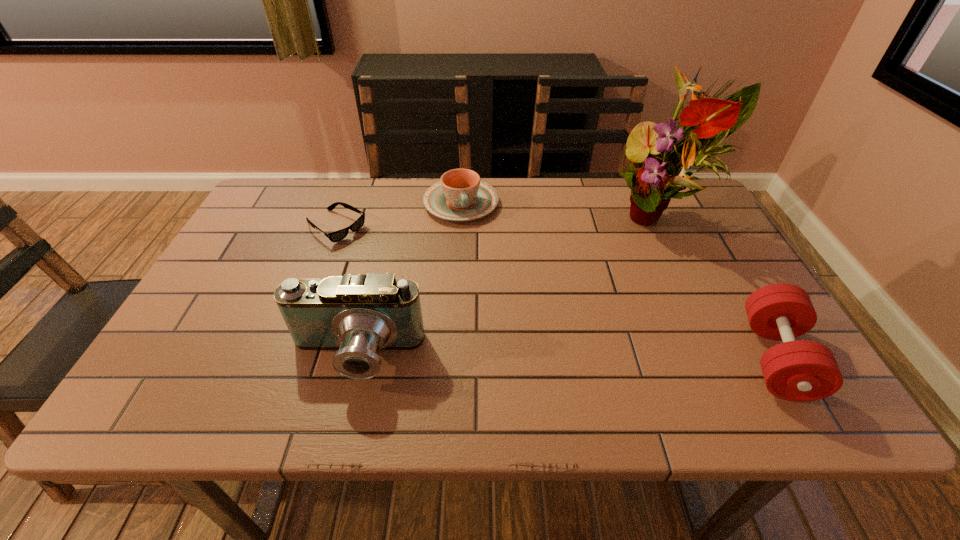
This screenshot has width=960, height=540. I want to click on camcorder, so click(x=358, y=315).

At what (x,y) coordinates should I click in order to perform the action: click on the third tallest object. Please return your answer as a coordinate pair (x, y). This screenshot has height=540, width=960. Looking at the image, I should click on (796, 370).

Where is `bouquet`? bouquet is located at coordinates (654, 179).

Locate an element on the screen. Image resolution: width=960 pixels, height=540 pixels. the second shortest object is located at coordinates (460, 195).

The width and height of the screenshot is (960, 540). Identify the location of the shortest object. (339, 235).

Identify the location of free space located on the left of the dumbbell. This screenshot has height=540, width=960. (607, 358).

Locate an element on the screen. vacant area situated 0.140m on the front-facing side of the tallest object is located at coordinates (613, 275).

I want to click on vacant space located on the front-facing side of the tallest object, so click(x=571, y=314).

Where is `vacant space positioned 0.400m on the front-facing side of the tallest object`? The width and height of the screenshot is (960, 540). vacant space positioned 0.400m on the front-facing side of the tallest object is located at coordinates (550, 334).

Where is `vacant space situated 0.260m on the handle side of the fourth tallest object`? The height and width of the screenshot is (540, 960). vacant space situated 0.260m on the handle side of the fourth tallest object is located at coordinates (487, 291).